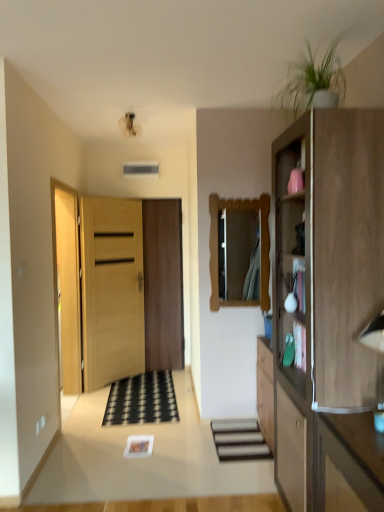
Where is `vacant space situated above wooden door at center, the second door from the front (from a real-world perspective)`? The image size is (384, 512). vacant space situated above wooden door at center, the second door from the front (from a real-world perspective) is located at coordinates (146, 196).